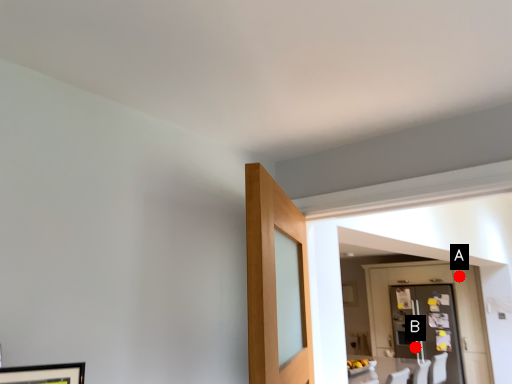
Question: Two points are circled on the image, labeled by A and B beside each circle. Which point is further to the camera?

Choices:
 (A) A is further
 (B) B is further

Answer: (B)